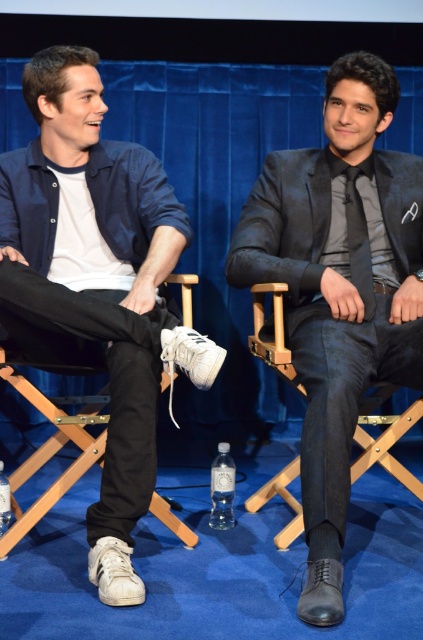
Question: From the image, what is the correct spatial relationship of white leather sneakers at lower left in relation to white fabric folding chair at left?

Choices:
 (A) left
 (B) right

Answer: (B)

Question: Can you confirm if white leather sneakers at lower left is positioned above black silk tie at center?

Choices:
 (A) no
 (B) yes

Answer: (A)

Question: Which object is the closest to the black silk tie at center?

Choices:
 (A) white fabric folding chair at left
 (B) white leather sneakers at lower left

Answer: (B)

Question: Among these objects, which one is nearest to the camera?

Choices:
 (A) shiny black suit at center
 (B) black silk tie at center
 (C) white fabric folding chair at left

Answer: (C)

Question: Which object is positioned closest to the white leather sneakers at lower left?

Choices:
 (A) black silk tie at center
 (B) white fabric folding chair at left

Answer: (B)

Question: Is white leather sneakers at lower left to the left of shiny black suit at center from the viewer's perspective?

Choices:
 (A) no
 (B) yes

Answer: (B)